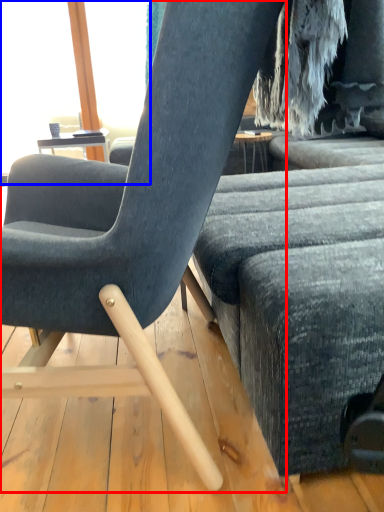
Question: Which point is further to the camera, chair (highlighted by a red box) or window screen (highlighted by a blue box)?

Choices:
 (A) chair
 (B) window screen

Answer: (B)